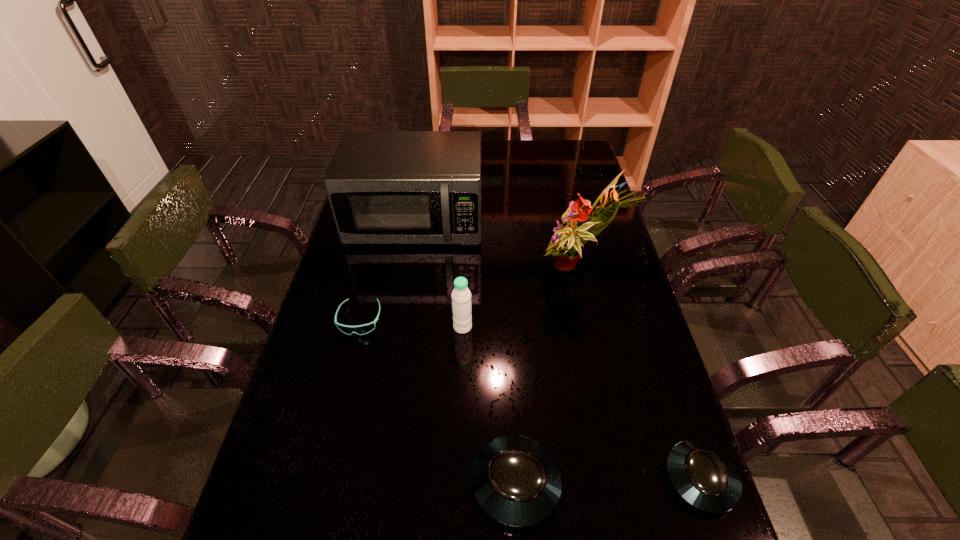
Locate an element on the screen. blank space that satisfies the following two spatial constraints: 1. on the front-facing side of the shortest object; 2. on the left side of the water bottle is located at coordinates (358, 327).

The image size is (960, 540). In order to click on vacant region that satisfies the following two spatial constraints: 1. on the front-facing side of the sunglasses; 2. on the left side of the third tallest object in this screenshot , I will do `click(358, 327)`.